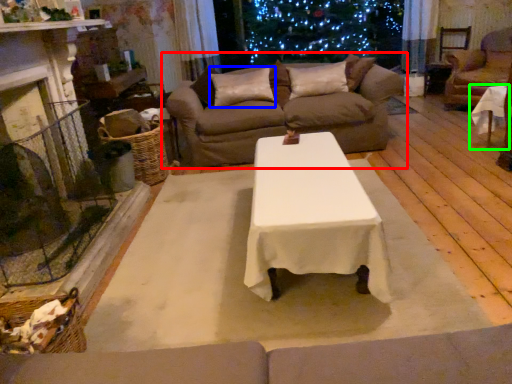
Question: Which object is positioned farthest from studio couch (highlighted by a red box)? Select from pillow (highlighted by a blue box) and table (highlighted by a green box).

Choices:
 (A) pillow
 (B) table

Answer: (B)